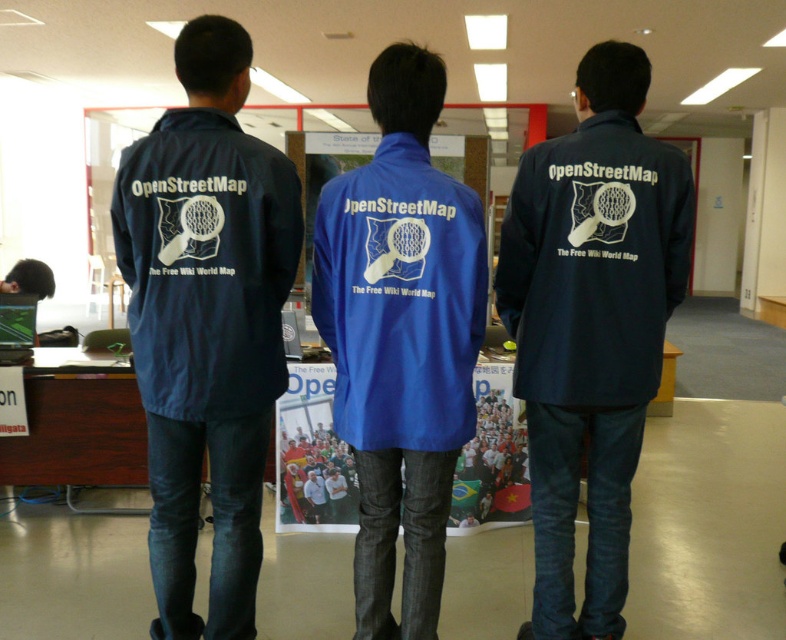
In the scene shown: Can you confirm if navy blue jacket at left is positioned below navy blue jacket at center?

Incorrect, navy blue jacket at left is not positioned below navy blue jacket at center.

Where is `navy blue jacket at left`? navy blue jacket at left is located at coordinates (206, 323).

You are a GUI agent. You are given a task and a screenshot of the screen. Output one action in this format:
    pyautogui.click(x=<x>, y=<y>)
    Task: Click on the navy blue jacket at left
    Image resolution: width=786 pixels, height=640 pixels.
    Given the screenshot: What is the action you would take?
    pyautogui.click(x=206, y=323)

Can you confirm if navy blue jacket at center is smaller than blue fabric jacket at center?

Actually, navy blue jacket at center might be larger than blue fabric jacket at center.

Does navy blue jacket at center appear on the right side of blue fabric jacket at center?

Indeed, navy blue jacket at center is positioned on the right side of blue fabric jacket at center.

Is point (671, 208) closer to camera compared to point (376, 564)?

No, it is behind (376, 564).

This screenshot has width=786, height=640. What are the coordinates of `navy blue jacket at center` in the screenshot? It's located at (590, 324).

Is navy blue jacket at left bigger than brushed metal desk at center?

Yes, navy blue jacket at left is bigger than brushed metal desk at center.

Is point (182, 132) less distant than point (502, 476)?

Yes, it is.

The height and width of the screenshot is (640, 786). Find the location of `navy blue jacket at left`. navy blue jacket at left is located at coordinates (206, 323).

At what (x,y) coordinates should I click in order to perform the action: click on navy blue jacket at left. Please return your answer as a coordinate pair (x, y). Image resolution: width=786 pixels, height=640 pixels. Looking at the image, I should click on (206, 323).